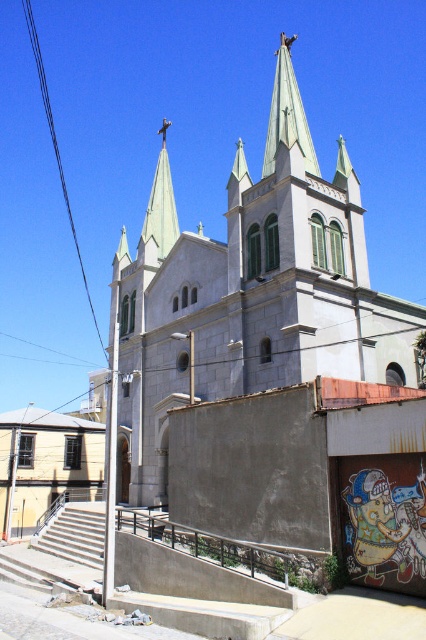
Question: Which object is closer to the camera taking this photo?

Choices:
 (A) green metallic steeple at center
 (B) white stone church at center
 (C) green metallic spire at upper center
 (D) black wire at upper left

Answer: (B)

Question: Can you confirm if green metallic steeple at center is positioned below black wire at upper left?

Choices:
 (A) yes
 (B) no

Answer: (A)

Question: Which point appears farthest from the camera in this image?

Choices:
 (A) (290, 161)
 (B) (172, 209)
 (C) (25, 3)
 (D) (293, 140)

Answer: (C)

Question: Can you confirm if green metallic steeple at center is positioned above green metallic spire at upper center?

Choices:
 (A) no
 (B) yes

Answer: (B)

Question: Is white stone church at center closer to the viewer compared to green metallic spire at upper center?

Choices:
 (A) yes
 (B) no

Answer: (A)

Question: Which point appears closest to the camera in this image?

Choices:
 (A) (152, 477)
 (B) (166, 227)
 (C) (278, 132)
 (D) (39, 54)

Answer: (C)